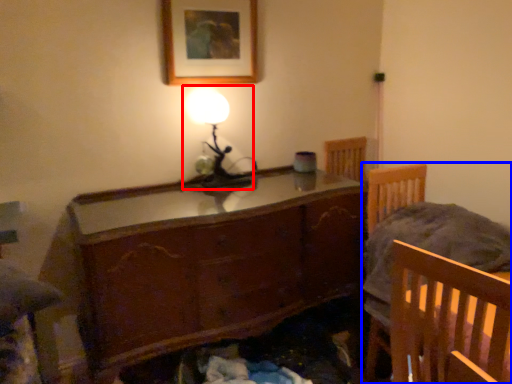
Question: Which object is closer to the camera taking this photo, table lamp (highlighted by a red box) or furniture (highlighted by a blue box)?

Choices:
 (A) table lamp
 (B) furniture

Answer: (B)